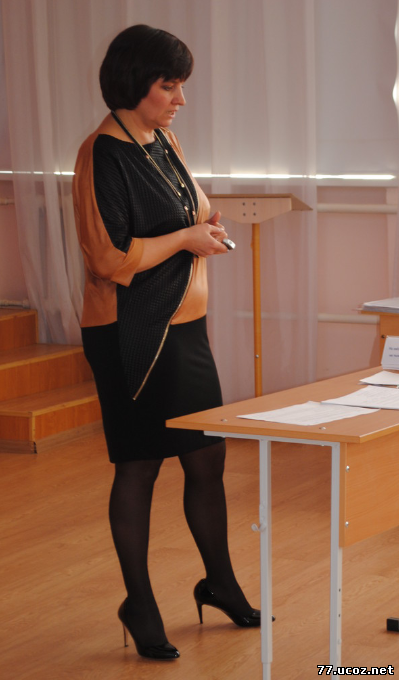
The width and height of the screenshot is (399, 680). What are the coordinates of `white metal table legs` in the screenshot? It's located at (265, 449), (339, 556).